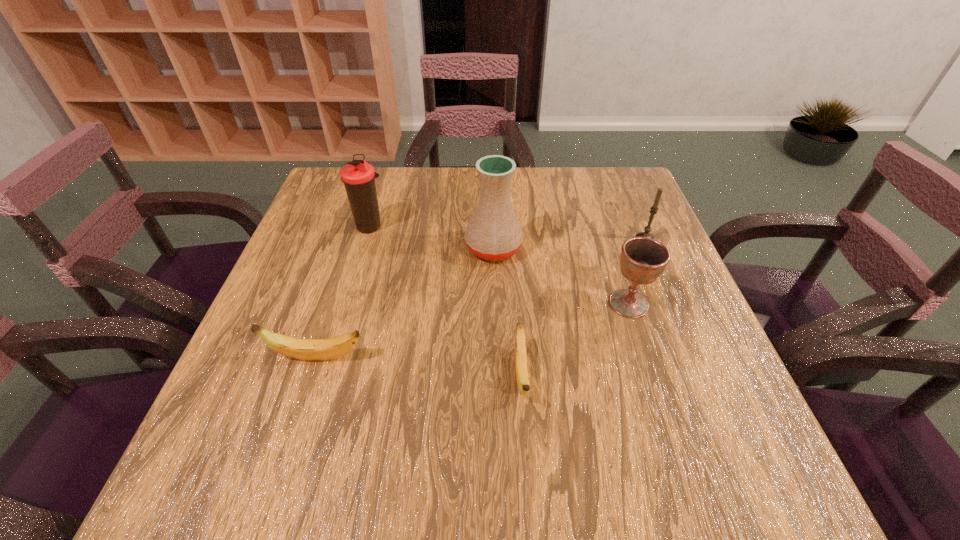
Image resolution: width=960 pixels, height=540 pixels. What are the coordinates of `vacant space located on the back of the candle` in the screenshot? It's located at (637, 221).

I want to click on vacant space located on the back of the fourth farthest object, so click(607, 237).

This screenshot has width=960, height=540. I want to click on free spot located on the right of the pottery, so click(592, 248).

The height and width of the screenshot is (540, 960). I want to click on object at the near edge, so click(x=522, y=376).

Where is `banana located in the left edge section of the desktop`? This screenshot has width=960, height=540. banana located in the left edge section of the desktop is located at coordinates (304, 349).

This screenshot has height=540, width=960. In order to click on thermos bottle at the left edge in this screenshot , I will do `click(358, 176)`.

Where is `candle present at the right edge`? candle present at the right edge is located at coordinates (654, 208).

Locate an element on the screen. chalice that is positioned at the right edge is located at coordinates (643, 260).

Find the location of `vacant space at the far edge`. vacant space at the far edge is located at coordinates coord(452,189).

You are a GUI agent. You are given a task and a screenshot of the screen. Output one action in this format:
    pyautogui.click(x=<x>, y=<y>)
    Task: Click on the free space at the near edge of the desktop
    The width and height of the screenshot is (960, 540).
    Given the screenshot: What is the action you would take?
    pyautogui.click(x=598, y=387)